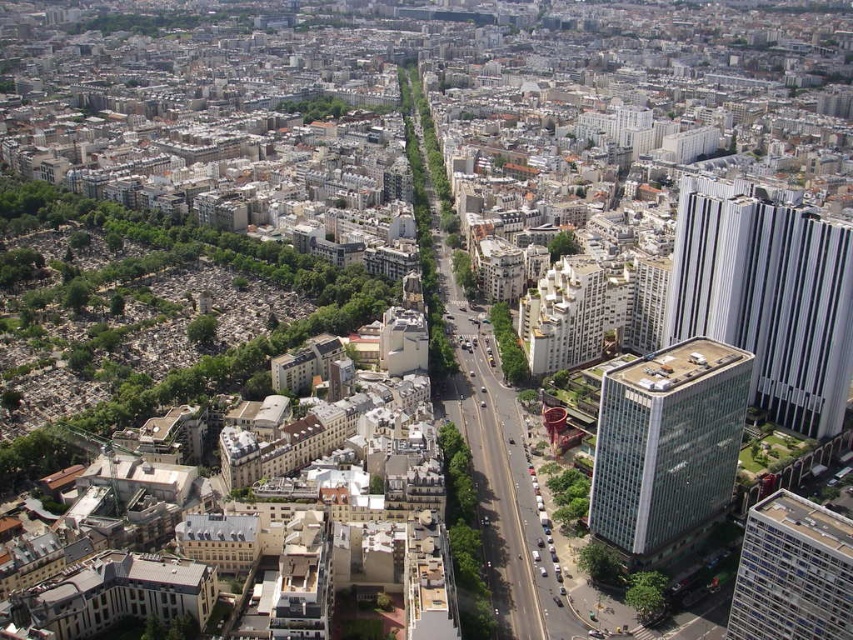
Question: Can you confirm if white glass skyscraper at upper right is positioned above transparent glass building at center-right?

Choices:
 (A) yes
 (B) no

Answer: (A)

Question: Which of the following is the farthest from the observer?

Choices:
 (A) white glass skyscraper at upper right
 (B) transparent glass building at center-right

Answer: (A)

Question: Is white glass skyscraper at upper right thinner than white glass building at center-right?

Choices:
 (A) yes
 (B) no

Answer: (B)

Question: Which of the following is the farthest from the observer?

Choices:
 (A) transparent glass building at center-right
 (B) white glass skyscraper at upper right
 (C) white glass building at center-right

Answer: (B)

Question: Which point is closer to the camera?

Choices:
 (A) (704, 179)
 (B) (838, 611)

Answer: (B)

Question: Does transparent glass building at center-right have a lesser width compared to white glass building at center-right?

Choices:
 (A) yes
 (B) no

Answer: (B)